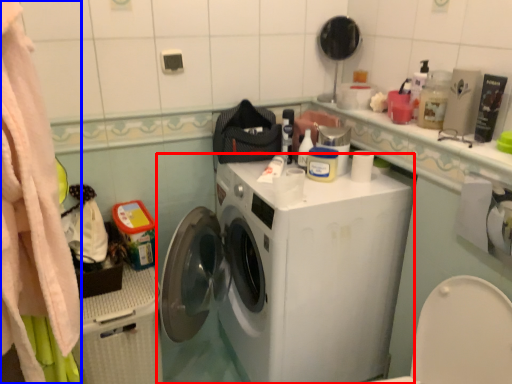
Question: Which of the following is the closest to the observer, washing machine (highlighted by a red box) or clothing (highlighted by a blue box)?

Choices:
 (A) washing machine
 (B) clothing

Answer: (B)